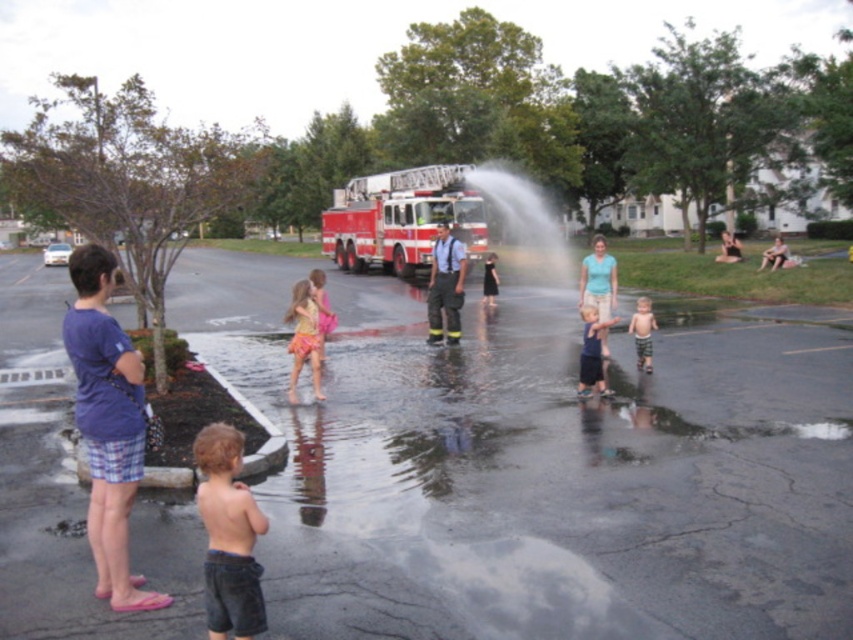
You are a photographer trying to capture the red shiny fire truck at center and the dark blue denim shorts at center in the same frame. Based on their sizes in the image, which object appears larger?

The red shiny fire truck at center appears larger than the dark blue denim shorts at center because it is taller.

You are a photographer trying to capture a photo of the red shiny fire truck at center and the dark blue denim shorts at center in the same frame. Based on their sizes, which object should you focus on first to ensure both are in the frame?

The red shiny fire truck at center is wider than the dark blue denim shorts at center, so you should focus on the red shiny fire truck at center first to ensure both fit in the frame.

You are standing at the point labeled as point [598,280] in the image. What is the color of the clothing item located exactly at this point?

The light blue cotton shirt at center is located exactly at point [598,280].